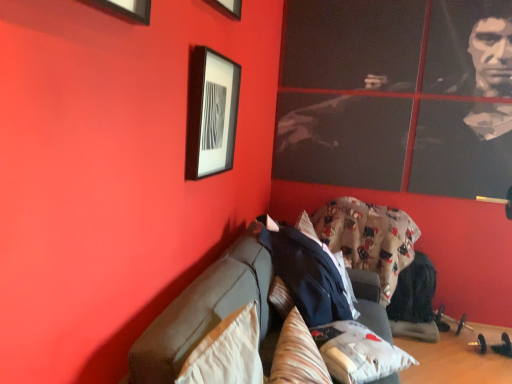
Question: From a real-world perspective, does matte black picture frame at upper left stand above fluffy white pillow at lower center, the 3th pillow from the left?

Choices:
 (A) no
 (B) yes

Answer: (B)

Question: Is fluffy white pillow at lower center, the 3th pillow from the left, completely or partially inside matte black picture frame at upper left?

Choices:
 (A) yes
 (B) no

Answer: (B)

Question: Considering the relative sizes of matte black picture frame at upper left and fluffy white pillow at lower center, the 3th pillow from the left, in the image provided, is matte black picture frame at upper left bigger than fluffy white pillow at lower center, the 3th pillow from the left,?

Choices:
 (A) yes
 (B) no

Answer: (B)

Question: From the image's perspective, would you say matte black picture frame at upper left is shown under fluffy white pillow at lower center, positioned as the first pillow in right-to-left order?

Choices:
 (A) yes
 (B) no

Answer: (B)

Question: Is matte black picture frame at upper left aimed at fluffy white pillow at lower center, positioned as the first pillow in right-to-left order?

Choices:
 (A) yes
 (B) no

Answer: (B)

Question: Can you confirm if matte black picture frame at upper left is positioned to the right of fluffy white pillow at lower center, the 3th pillow from the left?

Choices:
 (A) no
 (B) yes

Answer: (A)

Question: Is matte black picture frame at upper left surrounded by fluffy cotton blanket at center?

Choices:
 (A) no
 (B) yes

Answer: (A)

Question: Considering the relative sizes of fluffy cotton blanket at center and matte black picture frame at upper left in the image provided, is fluffy cotton blanket at center wider than matte black picture frame at upper left?

Choices:
 (A) no
 (B) yes

Answer: (B)

Question: Is fluffy cotton blanket at center located outside matte black picture frame at upper left?

Choices:
 (A) yes
 (B) no

Answer: (A)

Question: From the image's perspective, is fluffy cotton blanket at center under matte black picture frame at upper left?

Choices:
 (A) yes
 (B) no

Answer: (A)

Question: Is fluffy cotton blanket at center far from matte black picture frame at upper left?

Choices:
 (A) no
 (B) yes

Answer: (B)

Question: From a real-world perspective, is fluffy cotton blanket at center on matte black picture frame at upper left?

Choices:
 (A) yes
 (B) no

Answer: (B)

Question: From a real-world perspective, does beige fabric pillow at lower left, placed as the 1th pillow when sorted from left to right, stand above fluffy white pillow at lower center, positioned as the first pillow in right-to-left order?

Choices:
 (A) no
 (B) yes

Answer: (B)